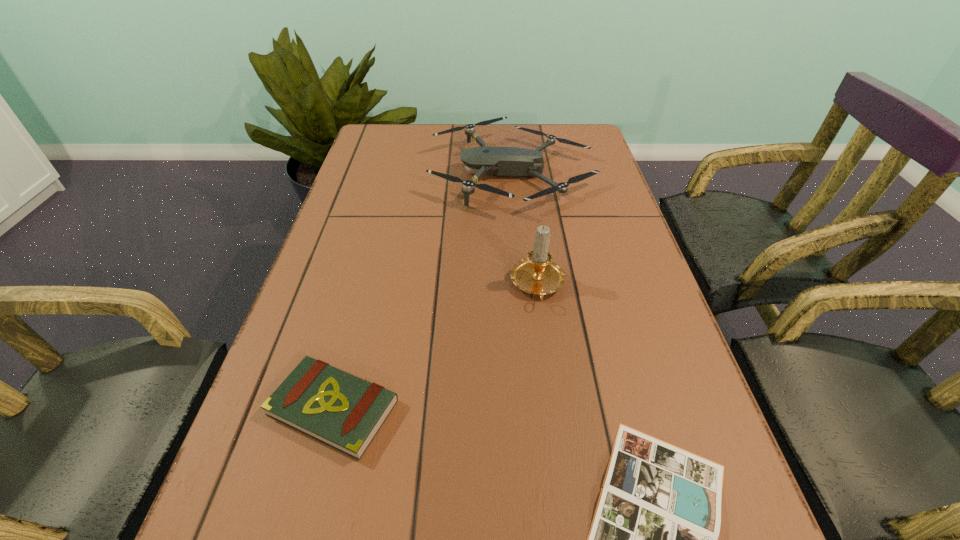
The image size is (960, 540). What are the coordinates of `the tallest object` in the screenshot? It's located at (538, 274).

I want to click on candle, so click(x=538, y=274).

At what (x,y) coordinates should I click in order to perform the action: click on drone. Please return your answer as a coordinate pair (x, y). This screenshot has width=960, height=540. Looking at the image, I should click on (498, 161).

Find the location of a particular element. This screenshot has width=960, height=540. the third shortest object is located at coordinates (498, 161).

Where is `the third tallest object`? Image resolution: width=960 pixels, height=540 pixels. the third tallest object is located at coordinates (345, 412).

You are a GUI agent. You are given a task and a screenshot of the screen. Output one action in this format:
    pyautogui.click(x=<x>, y=<y>)
    Task: Click on the taller book
    This screenshot has height=540, width=960.
    Given the screenshot: What is the action you would take?
    pyautogui.click(x=345, y=412)

Find the location of a particular element. The height and width of the screenshot is (540, 960). free space located on the right of the tallest object is located at coordinates (602, 286).

Locate an element on the screen. free region located with a camera mounted on the front of the drone is located at coordinates (402, 173).

The image size is (960, 540). In order to click on free location located with a camera mounted on the front of the drone in this screenshot , I will do `click(382, 173)`.

You are a GUI agent. You are given a task and a screenshot of the screen. Output one action in this format:
    pyautogui.click(x=<x>, y=<y>)
    Task: Click on the vacant space located 0.230m with a camera mounted on the front of the drone
    This screenshot has height=540, width=960.
    Given the screenshot: What is the action you would take?
    pyautogui.click(x=350, y=173)